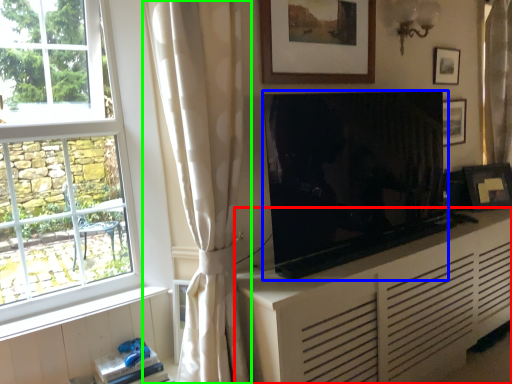
Question: Based on their relative distances, which object is nearer to cabinetry (highlighted by a red box)? Choose from television (highlighted by a blue box) and curtain (highlighted by a green box).

Choices:
 (A) television
 (B) curtain

Answer: (A)